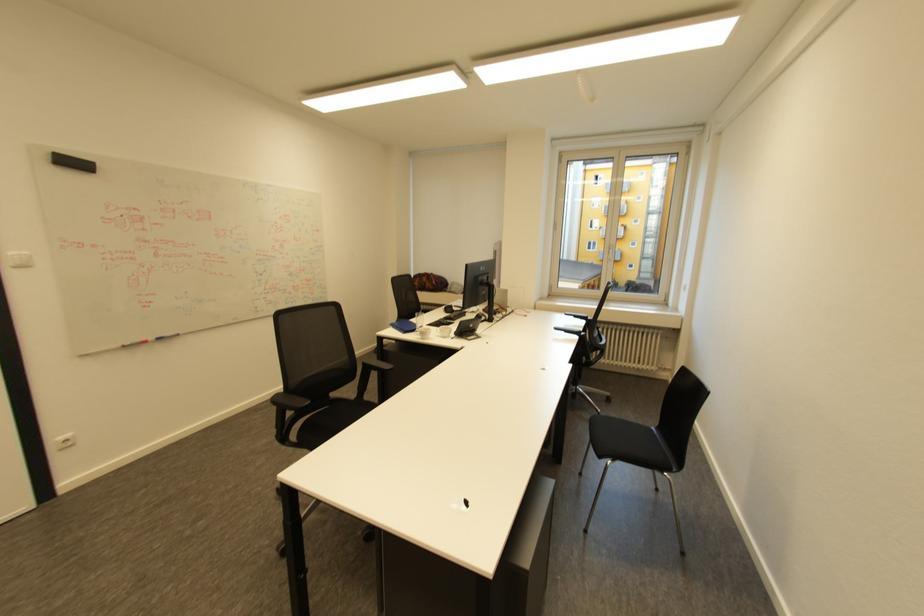
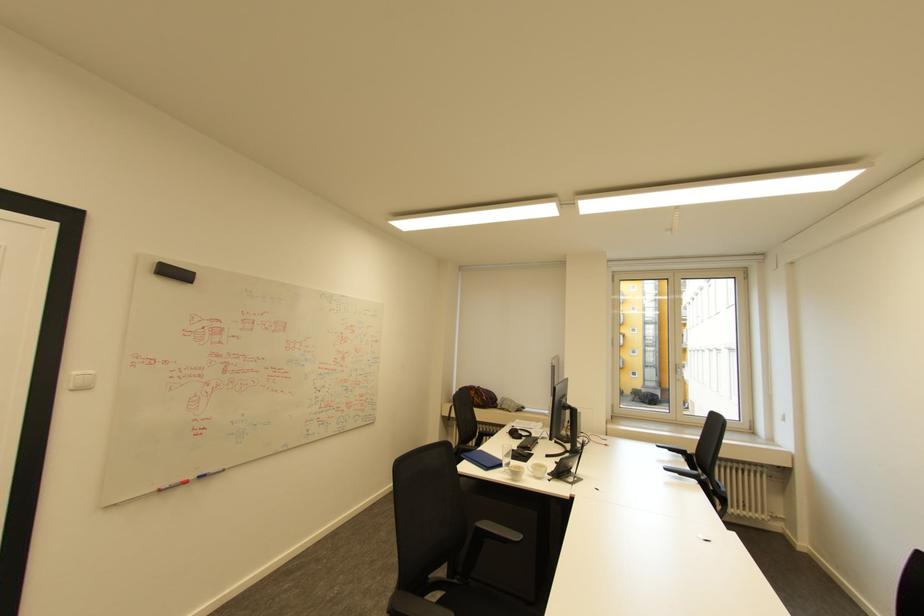
Find the pixel in the second image that matches point 49,156 in the first image.

(155, 265)